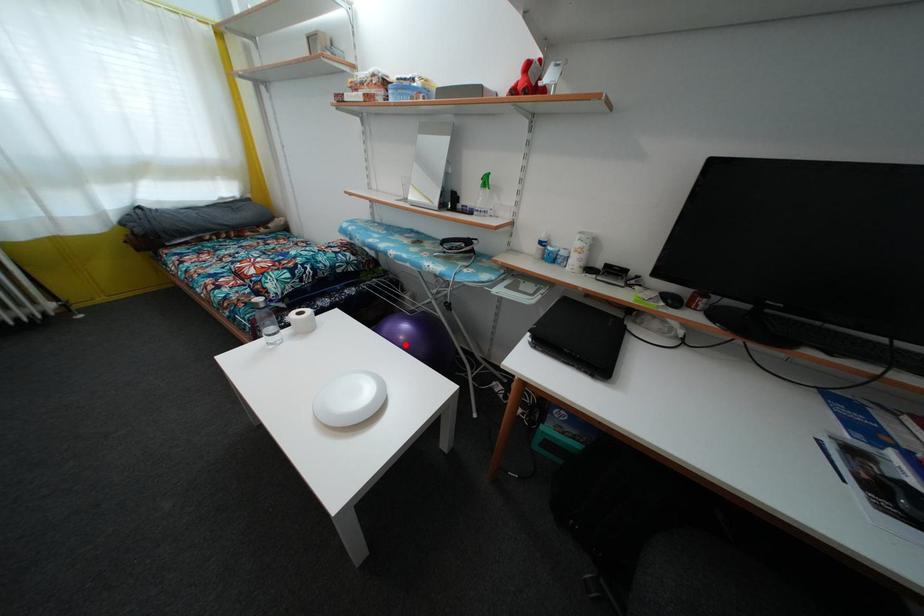
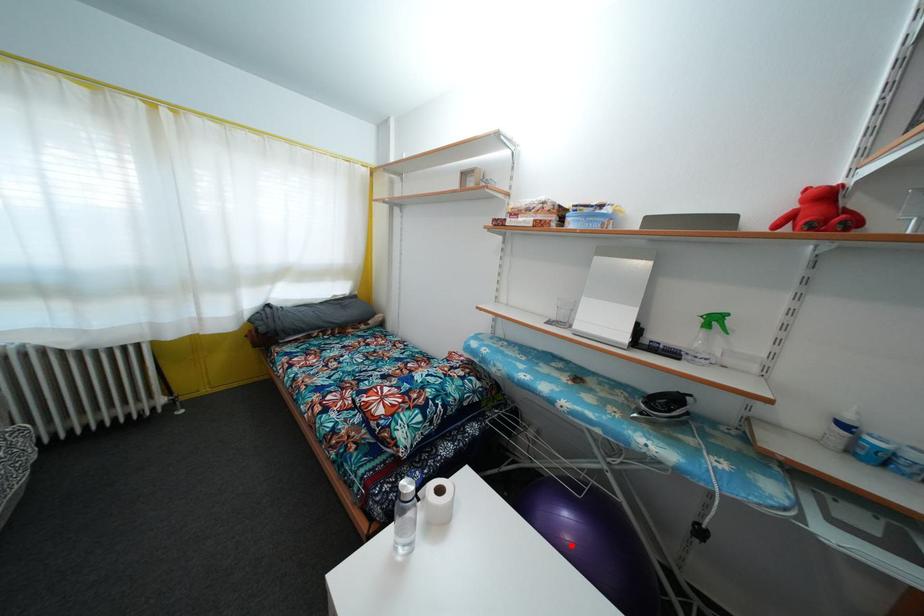
I am providing you with two images of the same scene from different viewpoints. A red point is marked on the first image and another point is marked on the second image. Are the points marked in image1 and image2 representing the same 3D position?

Yes